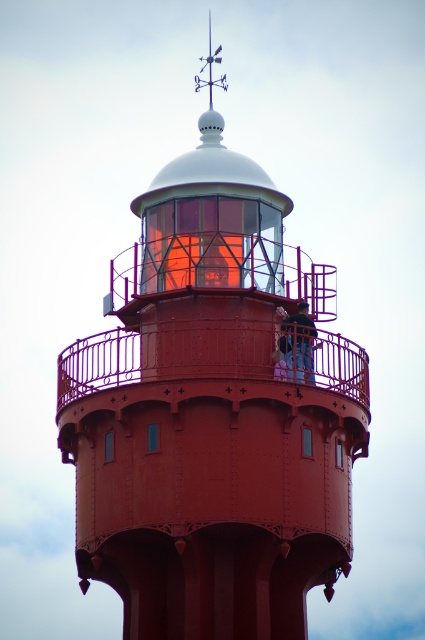
Question: Is smooth red lighthouse at center wider than blue denim jeans at center?

Choices:
 (A) no
 (B) yes

Answer: (B)

Question: Does smooth red lighthouse at center lie behind blue denim jeans at center?

Choices:
 (A) yes
 (B) no

Answer: (B)

Question: Which object appears closest to the camera in this image?

Choices:
 (A) blue denim jeans at center
 (B) smooth red lighthouse at center

Answer: (B)

Question: Which point is farther to the camera?

Choices:
 (A) (286, 362)
 (B) (288, 627)

Answer: (B)

Question: Can you confirm if smooth red lighthouse at center is positioned below blue denim jeans at center?

Choices:
 (A) yes
 (B) no

Answer: (B)

Question: Among these objects, which one is farthest from the camera?

Choices:
 (A) smooth red lighthouse at center
 (B) blue denim jeans at center

Answer: (B)